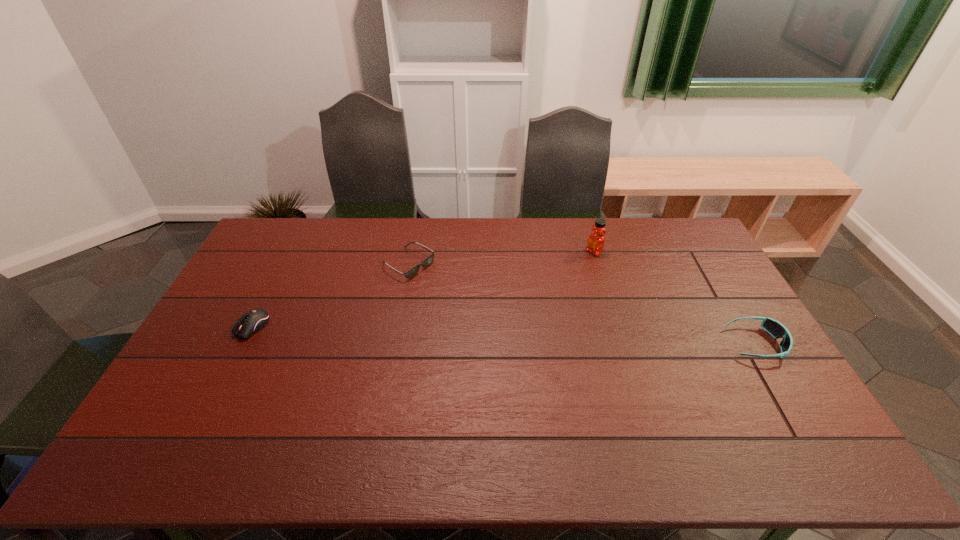
Locate an element on the screen. The width and height of the screenshot is (960, 540). the leftmost object is located at coordinates (254, 320).

I want to click on the nearer sunglasses, so click(777, 330).

Identify the location of the right sunglasses. (777, 330).

At what (x,y) coordinates should I click in order to perform the action: click on honey. Please return your answer as a coordinate pair (x, y). The width and height of the screenshot is (960, 540). Looking at the image, I should click on (596, 241).

Find the location of `the second object from right to left`. the second object from right to left is located at coordinates (596, 241).

Identify the location of the second object from left to right. (413, 271).

Locate an element on the screen. the shorter sunglasses is located at coordinates (413, 271).

The image size is (960, 540). Identify the location of free space located 0.140m on the right of the computer mouse. (313, 327).

I want to click on free location located on the front label of the tallest object, so (579, 260).

This screenshot has width=960, height=540. What are the coordinates of `free space located on the front label of the tallest object` in the screenshot? It's located at (516, 296).